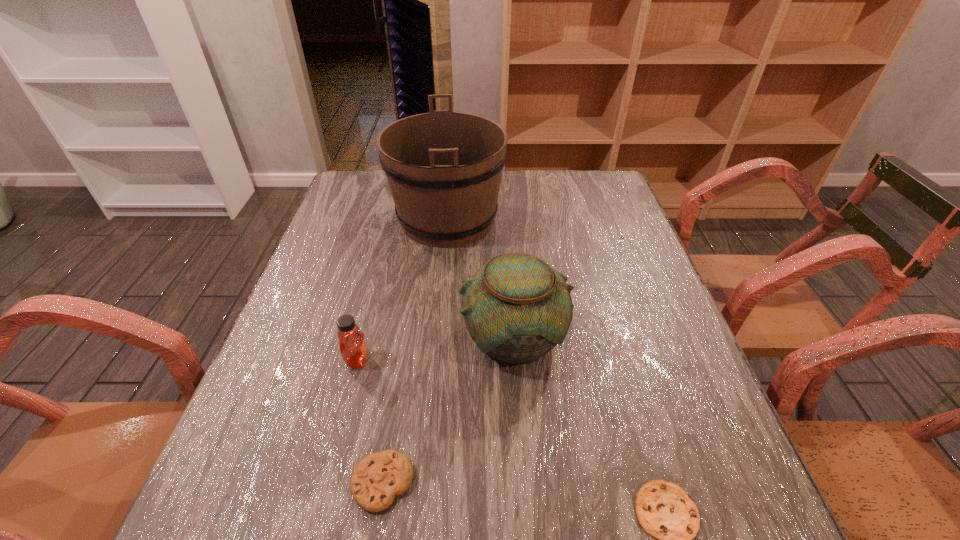
At what (x,y) coordinates should I click in order to perform the action: click on object at the far edge. Please return your answer as a coordinate pair (x, y). The height and width of the screenshot is (540, 960). Looking at the image, I should click on (444, 168).

Find the location of `object that is positioned at the near edge`. object that is positioned at the near edge is located at coordinates (379, 477).

At what (x,y) coordinates should I click in order to perform the action: click on object positioned at the left edge. Please return your answer as a coordinate pair (x, y). Looking at the image, I should click on (353, 350).

Identify the location of free space at the near edge. Image resolution: width=960 pixels, height=540 pixels. (609, 532).

The height and width of the screenshot is (540, 960). In the image, there is a desktop. In order to click on vacant space at the left edge in this screenshot , I will do `click(340, 219)`.

This screenshot has width=960, height=540. Identify the location of vacant region at the right edge of the desktop. (715, 413).

The image size is (960, 540). I want to click on vacant space at the far left corner of the desktop, so click(372, 183).

Locate an element on the screen. This screenshot has width=960, height=540. vacant area at the far right corner is located at coordinates (608, 188).

You are a GUI agent. You are given a task and a screenshot of the screen. Output one action in this format:
    pyautogui.click(x=<x>, y=<y>)
    Task: Click on the free space between the third shortest object and the tallest object
    The image size is (960, 540).
    Given the screenshot: What is the action you would take?
    pyautogui.click(x=402, y=289)

The image size is (960, 540). Find the location of `free space between the fourth shortest object and the left cookie`. free space between the fourth shortest object and the left cookie is located at coordinates (447, 409).